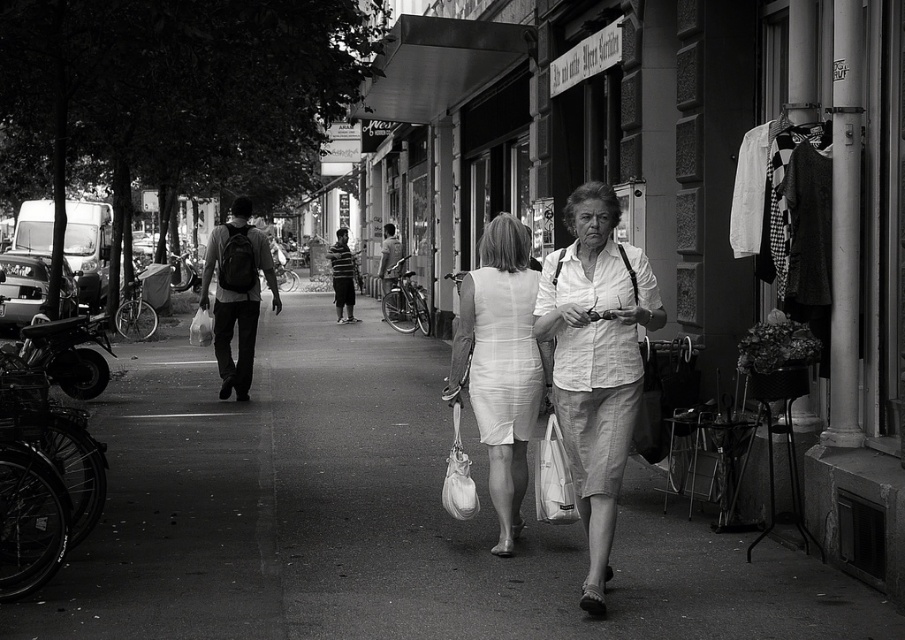
Based on the scene, can you determine if the smooth asphalt pavement at center is larger in size compared to the striped shirt at center?

Yes, the smooth asphalt pavement at center is bigger than the striped shirt at center according to the description.

You are a fashion designer observing two dresses in the image. The dresses are labeled as the white cotton dress at center and the white textured dress at center. Which dress is closer to the ground?

The white cotton dress at center is positioned under the white textured dress at center, so the white cotton dress at center is closer to the ground.